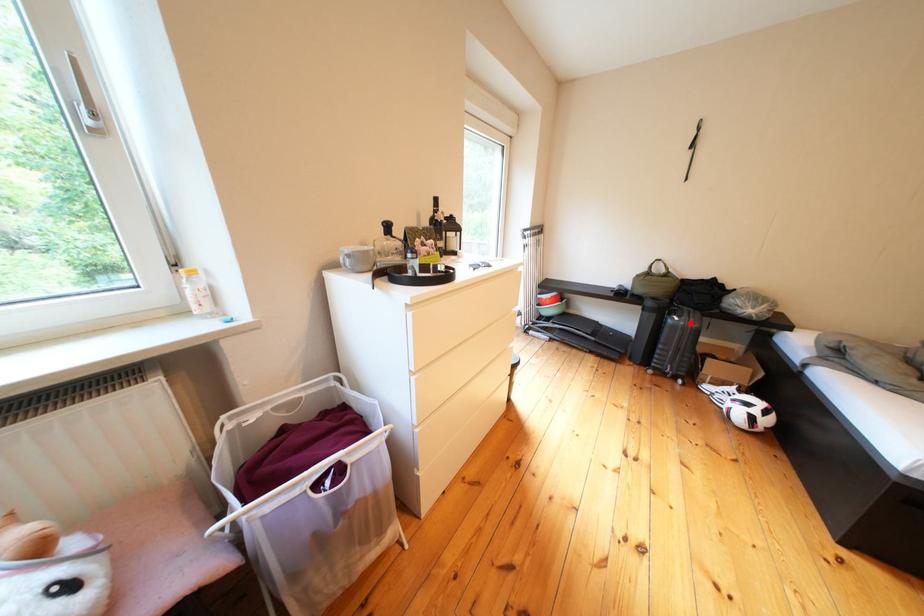
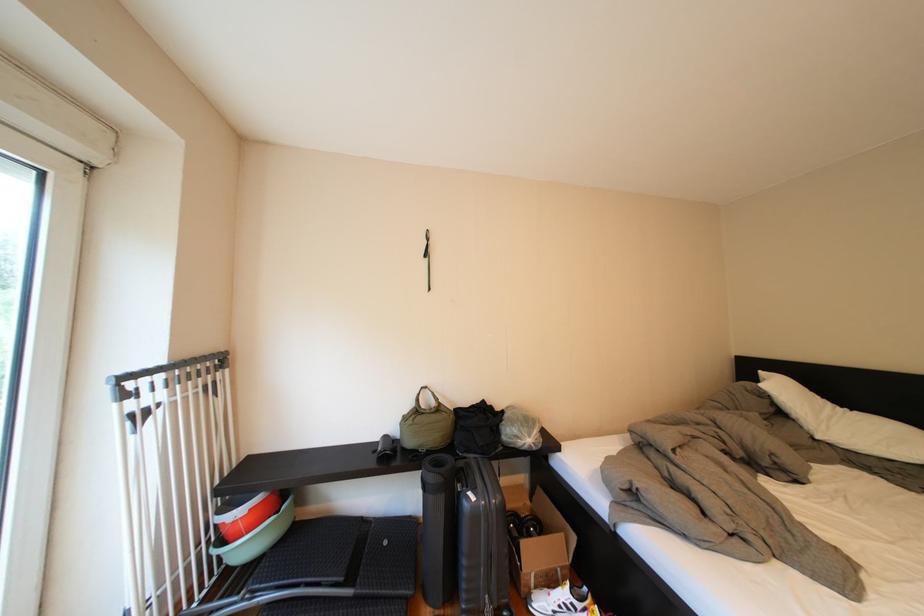
Question: I am providing you with two images of the same scene from different viewpoints. A red point is marked on the first image. At the location where the point appears in image 1, is it still visible in image 2?

Choices:
 (A) Yes
 (B) No

Answer: (A)